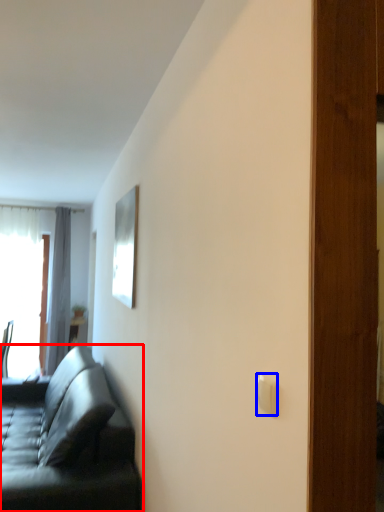
Question: Which object is further to the camera taking this photo, studio couch (highlighted by a red box) or light switch (highlighted by a blue box)?

Choices:
 (A) studio couch
 (B) light switch

Answer: (A)